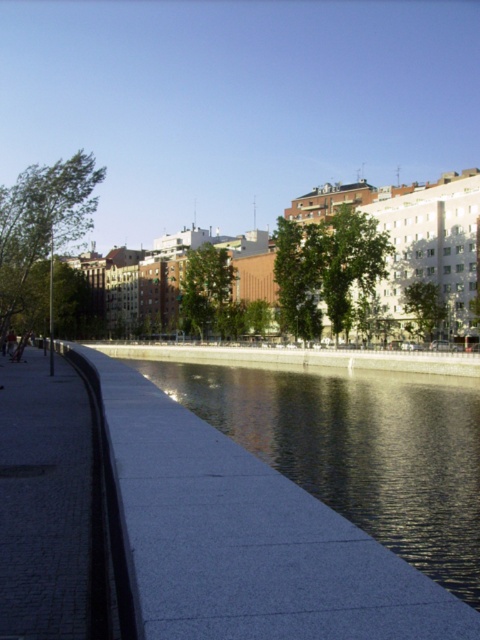
You are standing at the point marked by coordinates point (249,538) in the riverside scene. What object is exactly at this location?

The smooth concrete river at lower center is exactly at point (249,538).

You are a delivery person carrying a heavy box and need to choose a path to walk on. You have two options in the image. Which path is narrower between the smooth concrete river at lower center and the gray concrete pavement at lower left?

The smooth concrete river at lower center is thinner than the gray concrete pavement at lower left, so the smooth concrete river at lower center is narrower and thus not suitable for carrying a heavy box.

You are standing on the gray concrete pavement at lower left and want to cross to the smooth concrete river at lower center. Which direction should you move to reach it?

You should move to your right to reach the smooth concrete river at lower center since it is located to the right of the gray concrete pavement at lower left.